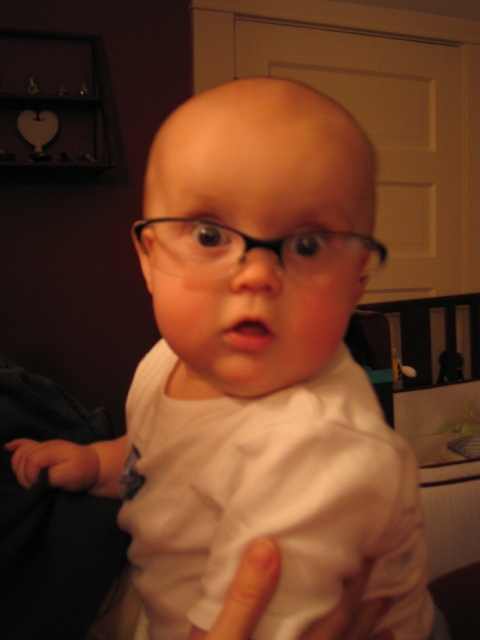
Does white soft hand at lower left appear over white matte finger at lower center?

Yes, white soft hand at lower left is above white matte finger at lower center.

Between white soft hand at lower left and white matte finger at lower center, which one has more height?

white soft hand at lower left is taller.

Is point (72, 456) positioned in front of point (251, 625)?

No, it is behind (251, 625).

Identify the location of white soft hand at lower left. (60, 464).